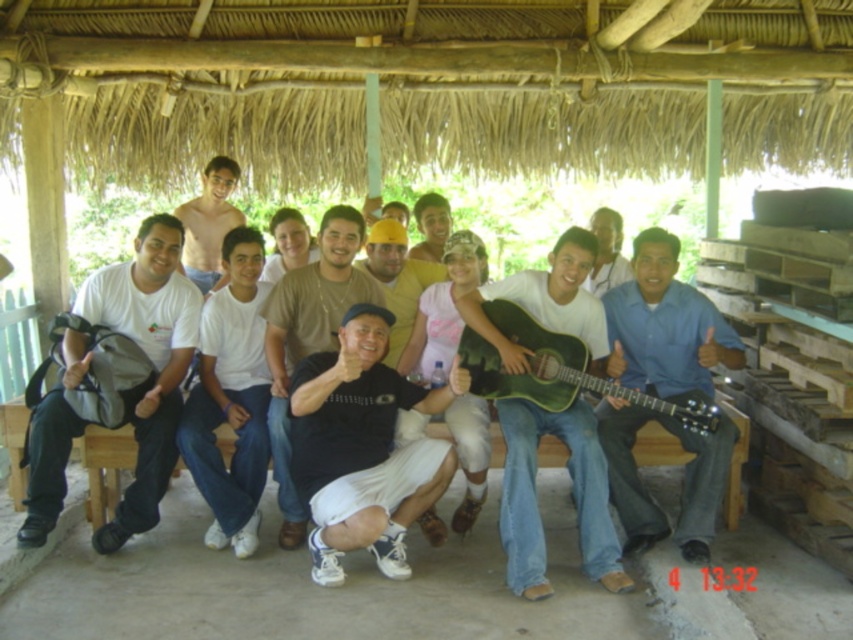
Which is more to the left, white cotton shirt at center or black cotton shirt at center?

white cotton shirt at center

Does point (231, 296) come farther from viewer compared to point (321, 314)?

That is True.

Measure the distance between point (x=236, y=259) and camera.

Point (x=236, y=259) is 14.86 feet away from camera.

I want to click on white cotton shirt at center, so click(x=231, y=397).

Can you confirm if blue glossy guitar at right is positioned to the right of shiny skin at center?

Yes, blue glossy guitar at right is to the right of shiny skin at center.

Measure the distance between point (694, 337) and camera.

They are 4.37 meters apart.

Where is `blue glossy guitar at right`? The width and height of the screenshot is (853, 640). blue glossy guitar at right is located at coordinates (665, 326).

Who is taller, black matte shirt at center or blue glossy guitar at right?

Standing taller between the two is blue glossy guitar at right.

Is black matte shirt at center in front of blue glossy guitar at right?

Yes, black matte shirt at center is in front of blue glossy guitar at right.

What are the coordinates of `black matte shirt at center` in the screenshot? It's located at (363, 449).

The height and width of the screenshot is (640, 853). Find the location of `black matte shirt at center`. black matte shirt at center is located at coordinates (363, 449).